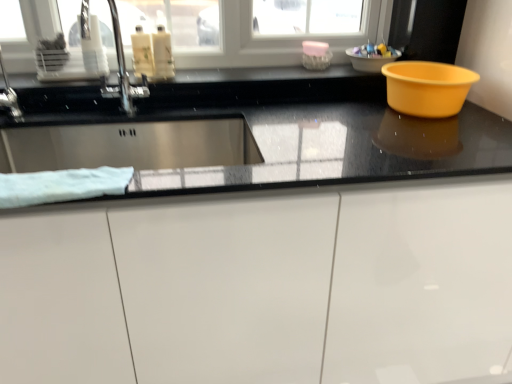
I want to click on free point to the left of translucent plastic bottles at upper center, which appears as the 1th liquid when viewed from the left, so click(x=108, y=76).